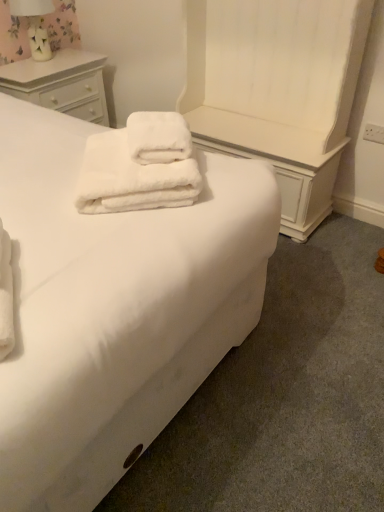
Where is `free spot below floral fabric lampshade at upper left (from a real-world perspective)`? The height and width of the screenshot is (512, 384). free spot below floral fabric lampshade at upper left (from a real-world perspective) is located at coordinates (44, 60).